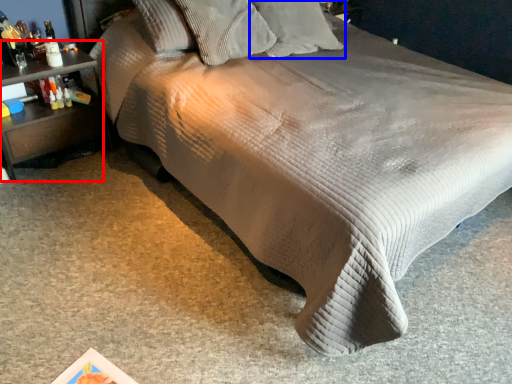
Question: Among these objects, which one is nearest to the camera, nightstand (highlighted by a red box) or pillow (highlighted by a blue box)?

Choices:
 (A) nightstand
 (B) pillow

Answer: (A)